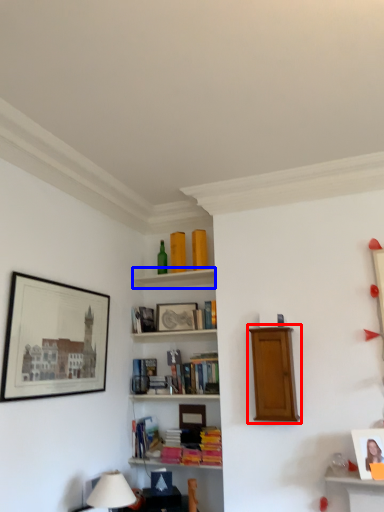
Question: Which object is further to the camera taking this photo, shelf (highlighted by a red box) or cabinet (highlighted by a blue box)?

Choices:
 (A) shelf
 (B) cabinet

Answer: (B)